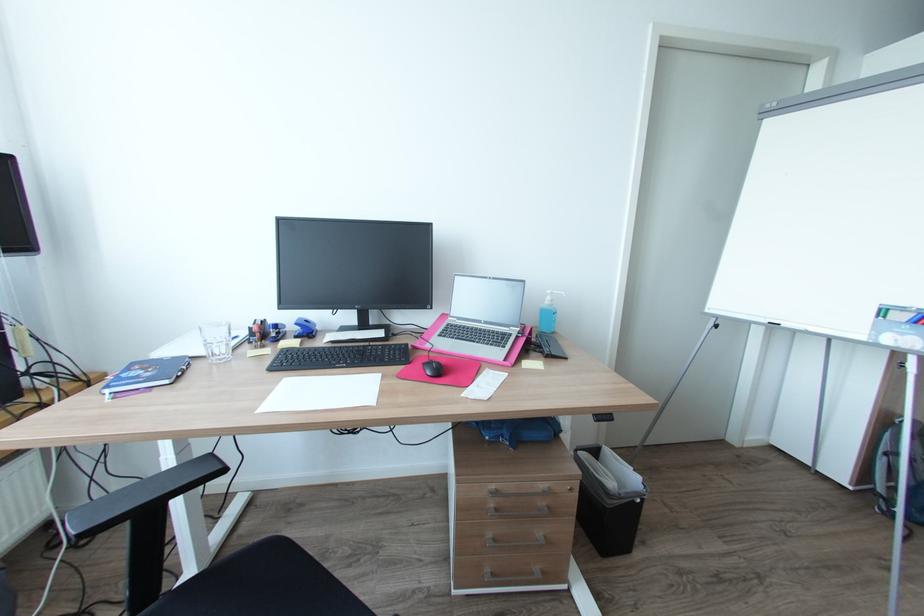
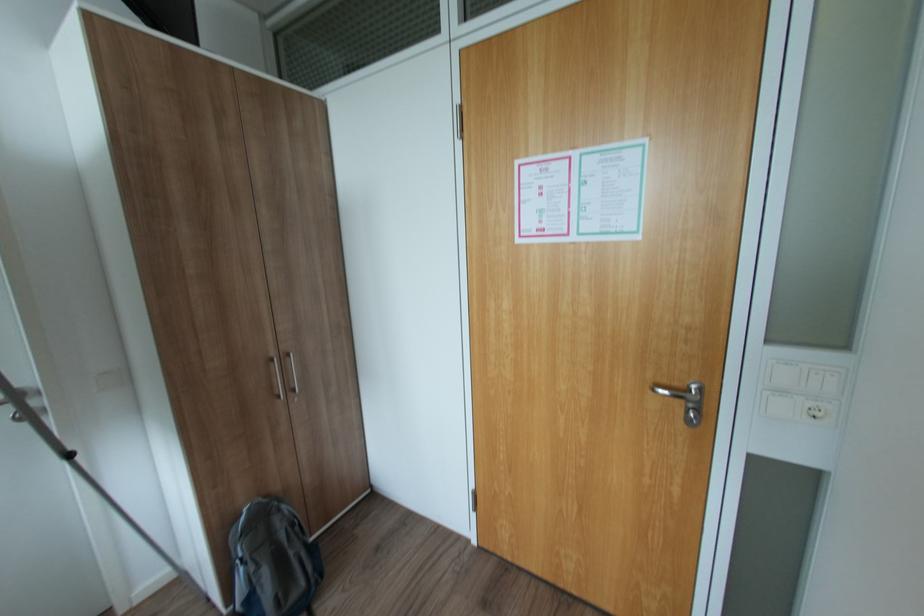
Locate, in the second image, the point that corresponds to the point at 885,490 in the first image.

(244, 608)